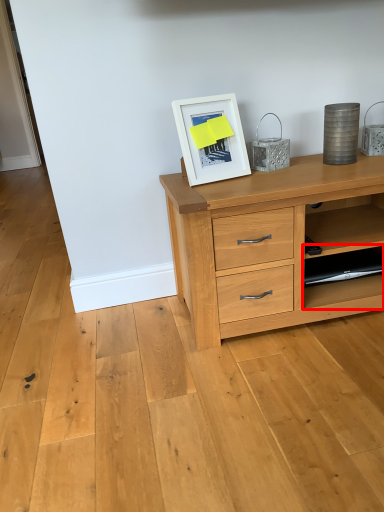
Question: From the image's perspective, what is the correct spatial positioning of shelf (annotated by the red box) in reference to picture frame?

Choices:
 (A) below
 (B) above

Answer: (A)